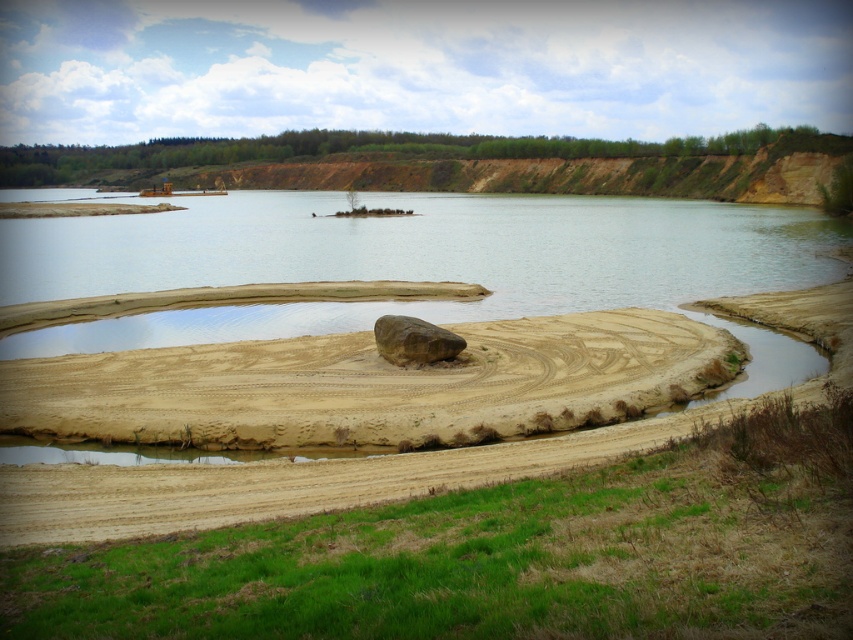
Who is shorter, clear water at center or brown sandy puddle at lower right?

brown sandy puddle at lower right is shorter.

Who is taller, clear water at center or brown sandy puddle at lower right?

Standing taller between the two is clear water at center.

Who is more distant from viewer, (109, 340) or (772, 340)?

The point (772, 340) is behind.

Where is `clear water at center`? This screenshot has height=640, width=853. clear water at center is located at coordinates (403, 259).

Consider the image. Who is more distant from viewer, (639, 257) or (401, 365)?

The point (639, 257) is more distant.

Who is positioned more to the left, clear water at center or brown rough rock at center?

clear water at center is more to the left.

Is point (596, 250) more distant than point (390, 321)?

That is True.

The width and height of the screenshot is (853, 640). I want to click on clear water at center, so click(403, 259).

Can you confirm if brown sandy dirt track at center is bigger than brown rough rock at center?

Yes, brown sandy dirt track at center is bigger than brown rough rock at center.

The width and height of the screenshot is (853, 640). Describe the element at coordinates (292, 483) in the screenshot. I see `brown sandy dirt track at center` at that location.

Is point (134, 356) farther from camera compared to point (405, 316)?

Yes, it is.

The height and width of the screenshot is (640, 853). I want to click on brown sandy dirt track at center, so click(x=292, y=483).